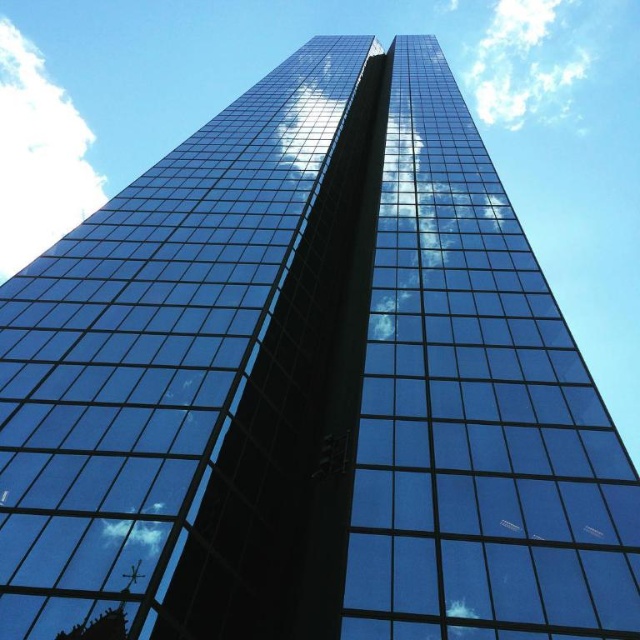
You are an architect designing a new skyscraper and want to ensure that the reflection of the clouds on the building does not obscure the central design element. Given that the white fluffy cloud at upper left and the white fluffy cloud at upper center are both reflected on the glass facade, which cloud would cast a larger reflection on the building?

The white fluffy cloud at upper left would cast a larger reflection on the building because it is larger in size than the white fluffy cloud at upper center.